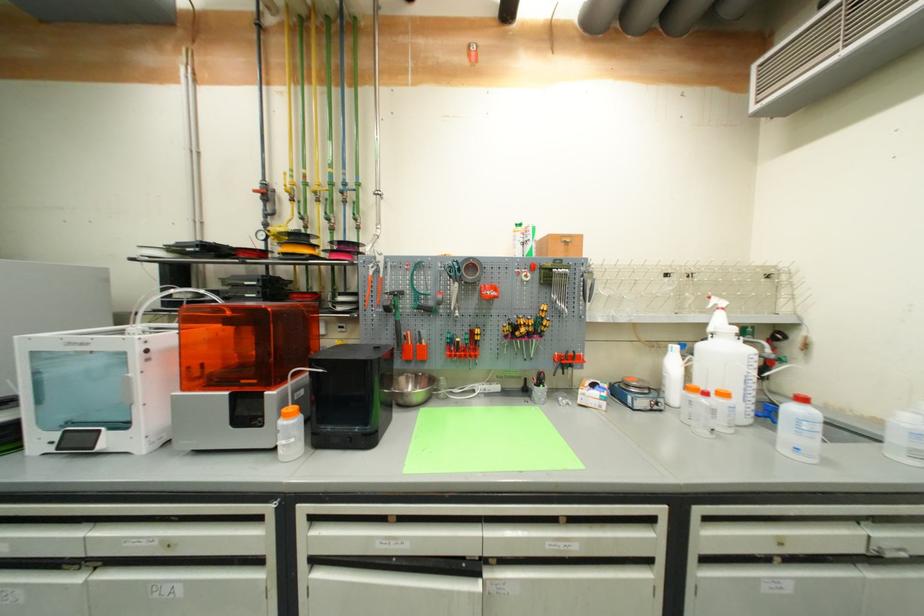
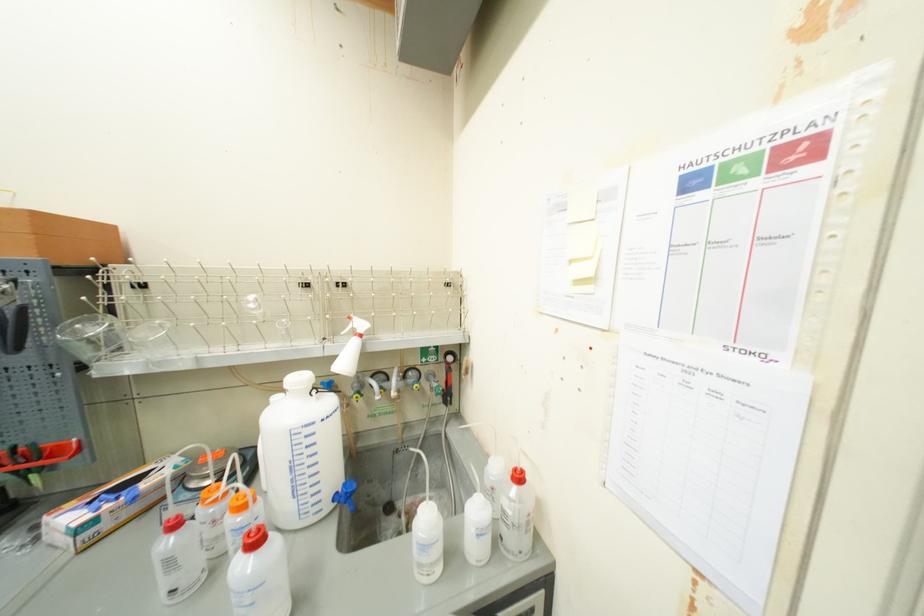
The point at (602,408) is marked in the first image. Where is the corresponding point in the second image?

(69, 551)